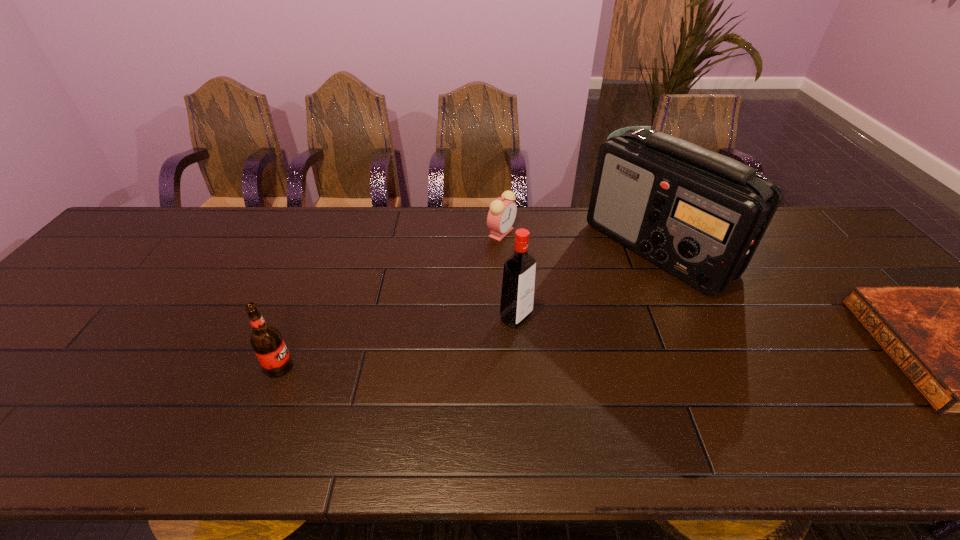
Find the location of a particular element. the third shortest object is located at coordinates (267, 342).

This screenshot has height=540, width=960. In order to click on root beer in this screenshot , I will do `click(267, 342)`.

Where is `the second tallest object`? This screenshot has height=540, width=960. the second tallest object is located at coordinates (517, 295).

The image size is (960, 540). Identify the location of radio receiver. (700, 215).

Find the location of `the tallest object`. the tallest object is located at coordinates (700, 215).

Image resolution: width=960 pixels, height=540 pixels. I want to click on the fourth tallest object, so click(x=501, y=216).

Identify the location of vacant point located on the left of the third shortest object. This screenshot has width=960, height=540. (226, 367).

I want to click on vacant space located on the front and back of the fourth shortest object, so click(x=582, y=357).

Locate an element on the screen. free space located 0.290m on the front and back of the fourth shortest object is located at coordinates (637, 392).

Where is `vacant area located 0.350m on the front and back of the fourth shortest object`? vacant area located 0.350m on the front and back of the fourth shortest object is located at coordinates (664, 408).